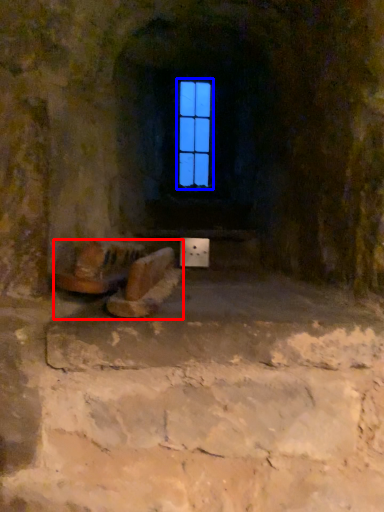
Question: Which point is further to the camera, furniture (highlighted by a red box) or window (highlighted by a blue box)?

Choices:
 (A) furniture
 (B) window

Answer: (B)